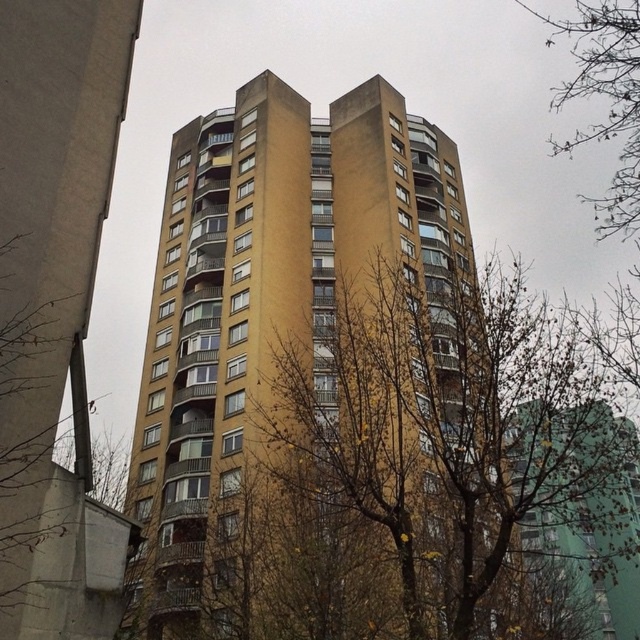
Can you confirm if bare branches at center is thinner than bare branches at upper right?

Yes.

Who is positioned more to the left, bare branches at center or bare branches at upper right?

From the viewer's perspective, bare branches at center appears more on the left side.

Does point (531, 417) come farther from viewer compared to point (616, 83)?

Yes, point (531, 417) is farther from viewer.

I want to click on bare branches at center, so click(429, 476).

Measure the distance from yellow concrete building at center to bare branches at upper right.

A distance of 72.79 feet exists between yellow concrete building at center and bare branches at upper right.

Can you confirm if yellow concrete building at center is positioned to the right of bare branches at upper right?

No, yellow concrete building at center is not to the right of bare branches at upper right.

Identify the location of yellow concrete building at center. The height and width of the screenshot is (640, 640). (268, 300).

Locate an element on the screen. yellow concrete building at center is located at coordinates (268, 300).

Is point (444, 419) positioned before point (243, 310)?

Yes, it is in front of point (243, 310).

Can you confirm if bare branches at center is wider than yellow concrete building at center?

Yes.

At what (x,y) coordinates should I click in order to perform the action: click on bare branches at center. Please return your answer as a coordinate pair (x, y). Looking at the image, I should click on (429, 476).